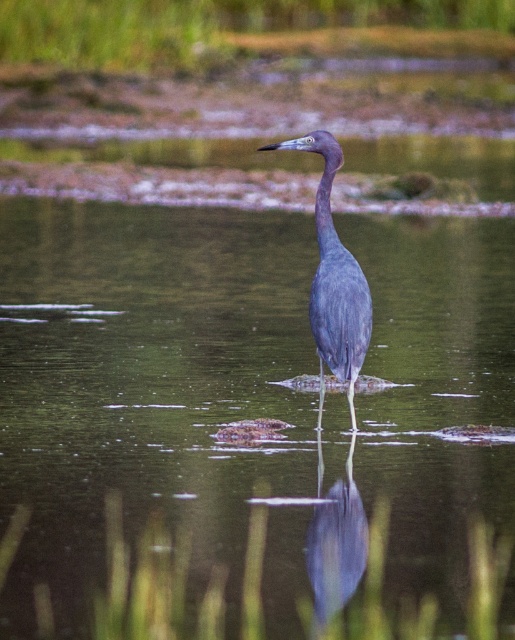
Is clear water at center taller than smooth gray heron at center?

Yes.

Between clear water at center and smooth gray heron at center, which one appears on the right side from the viewer's perspective?

smooth gray heron at center

Image resolution: width=515 pixels, height=640 pixels. I want to click on clear water at center, so click(x=245, y=400).

I want to click on clear water at center, so click(x=245, y=400).

Measure the distance between satin blue heron at center and smooth gray heron at center.

satin blue heron at center and smooth gray heron at center are 32.54 inches apart.

Is satin blue heron at center smaller than smooth gray heron at center?

No, satin blue heron at center is not smaller than smooth gray heron at center.

Which is in front, point (335, 244) or point (345, 506)?

Point (335, 244) is in front.

The image size is (515, 640). I want to click on satin blue heron at center, so click(x=334, y=280).

Is clear water at center thinner than satin blue heron at center?

Incorrect, clear water at center's width is not less than satin blue heron at center's.

Find the location of a particular element. The image size is (515, 640). clear water at center is located at coordinates (245, 400).